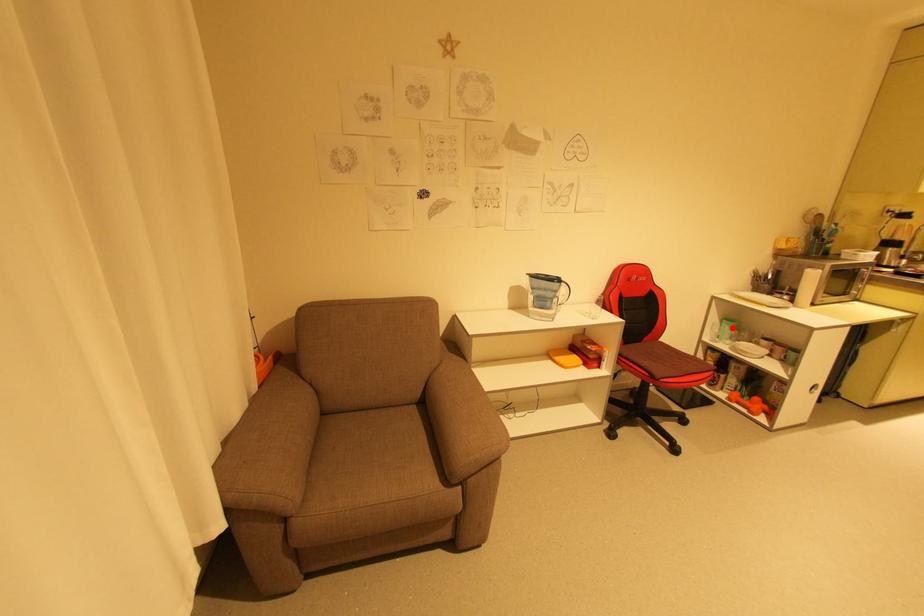
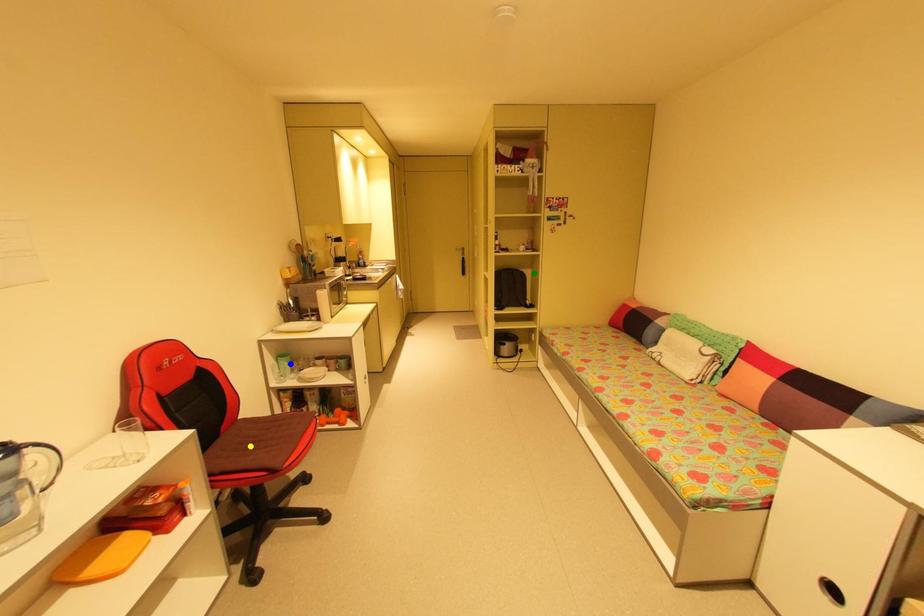
Question: I am providing you with two images of the same scene from different viewpoints. A red point is marked on the first image. You are given multiple points on the second image. Which point in image 2 represents the same 3d spot as the red point in image 1?

Choices:
 (A) green point
 (B) blue point
 (C) yellow point

Answer: (B)